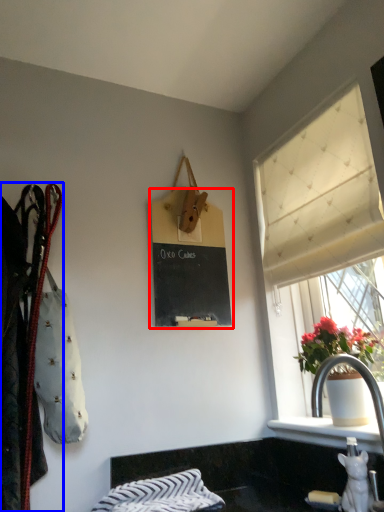
Question: Among these objects, which one is nearest to the camera, bulletin board (highlighted by a red box) or closet (highlighted by a blue box)?

Choices:
 (A) bulletin board
 (B) closet

Answer: (B)